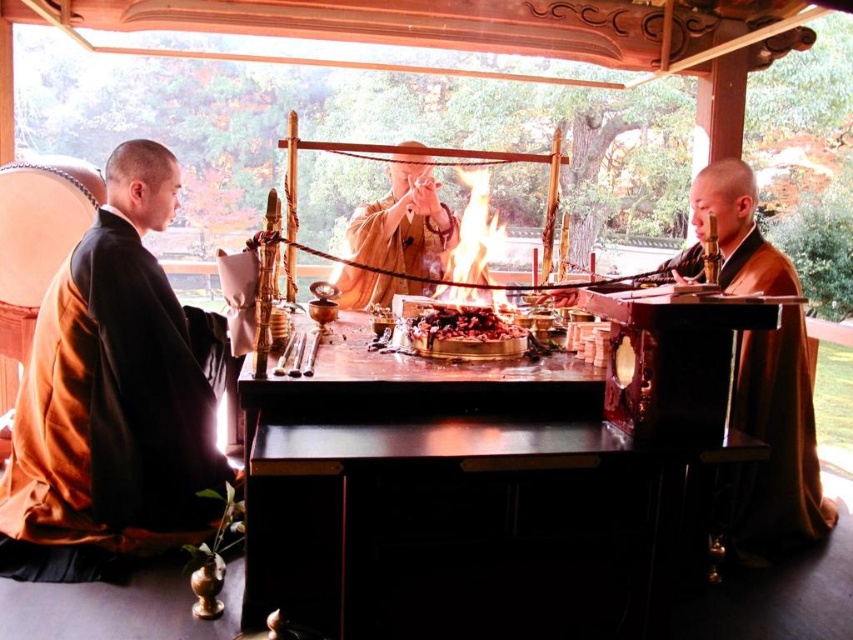
Question: Is orange silk robe at left bigger than matte gold robe at center?

Choices:
 (A) yes
 (B) no

Answer: (A)

Question: Does shiny dark wood table at center appear on the left side of brown silk monk at center?

Choices:
 (A) no
 (B) yes

Answer: (B)

Question: Which of the following is the closest to the observer?

Choices:
 (A) (474, 582)
 (B) (405, 212)
 (C) (467, 324)
 (D) (764, 248)

Answer: (A)

Question: Is shiny dark wood table at center below orange silk robe at left?

Choices:
 (A) yes
 (B) no

Answer: (A)

Question: Which point appears closest to the camera in this image?

Choices:
 (A) (442, 316)
 (B) (364, 476)
 (C) (370, 228)

Answer: (B)

Question: Among these points, which one is nearest to the camera?

Choices:
 (A) (424, 180)
 (B) (717, 195)
 (C) (764, 536)
 (D) (440, 317)

Answer: (D)